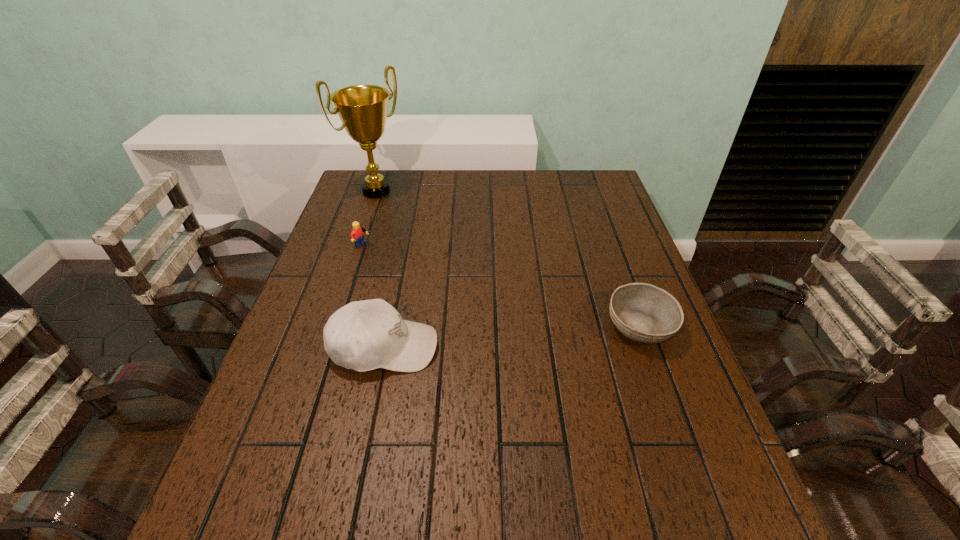
Where is `free point at the far edge`? Image resolution: width=960 pixels, height=540 pixels. free point at the far edge is located at coordinates (516, 195).

You are a GUI agent. You are given a task and a screenshot of the screen. Output one action in this format:
    pyautogui.click(x=<x>, y=<y>)
    Task: Click on the vacant space at the left edge
    The image size is (960, 540).
    Given the screenshot: What is the action you would take?
    pyautogui.click(x=375, y=254)

In order to click on free location at the right edge of the desktop in this screenshot , I will do `click(625, 251)`.

I want to click on free region at the far left corner, so click(356, 172).

In the image, there is a desktop. What are the coordinates of `vacant space at the far right corner` in the screenshot? It's located at (593, 176).

Identify the location of vacant space in between the Lego and the baseball cap. This screenshot has width=960, height=540. (375, 296).

The width and height of the screenshot is (960, 540). In order to click on vacant space in between the Lego and the rightmost object in this screenshot , I will do [x=503, y=286].

Image resolution: width=960 pixels, height=540 pixels. I want to click on free space between the Lego and the baseball cap, so pos(375,296).

Where is `unoccupied position between the baseball cap and the Lego`? unoccupied position between the baseball cap and the Lego is located at coordinates (375, 296).

At what (x,y) coordinates should I click in order to perform the action: click on free space between the second farthest object and the baseball cap. Please return your answer as a coordinate pair (x, y). Image resolution: width=960 pixels, height=540 pixels. Looking at the image, I should click on (375, 296).